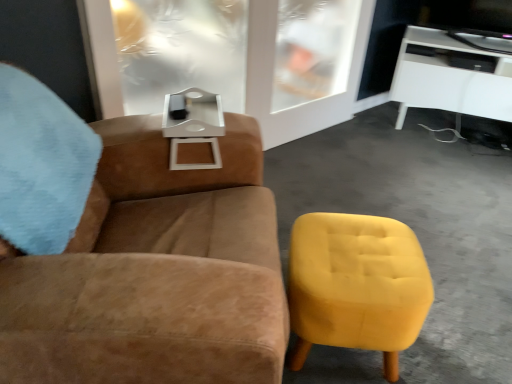
Question: Does white glossy tv stand at upper right contain suede brown armchair at upper left?

Choices:
 (A) no
 (B) yes

Answer: (A)

Question: From the image's perspective, is white glossy tv stand at upper right over suede brown armchair at upper left?

Choices:
 (A) no
 (B) yes

Answer: (B)

Question: Is white glossy tv stand at upper right located outside suede brown armchair at upper left?

Choices:
 (A) no
 (B) yes

Answer: (B)

Question: From a real-world perspective, does white glossy tv stand at upper right stand above suede brown armchair at upper left?

Choices:
 (A) no
 (B) yes

Answer: (A)

Question: Considering the relative sizes of white glossy tv stand at upper right and suede brown armchair at upper left in the image provided, is white glossy tv stand at upper right taller than suede brown armchair at upper left?

Choices:
 (A) yes
 (B) no

Answer: (B)

Question: Is yellow fabric ottoman at lower right in front of or behind suede brown armchair at upper left in the image?

Choices:
 (A) front
 (B) behind

Answer: (B)

Question: Considering the relative positions of yellow fabric ottoman at lower right and suede brown armchair at upper left in the image provided, is yellow fabric ottoman at lower right to the left or to the right of suede brown armchair at upper left?

Choices:
 (A) right
 (B) left

Answer: (A)

Question: From the image's perspective, relative to suede brown armchair at upper left, is yellow fabric ottoman at lower right above or below?

Choices:
 (A) above
 (B) below

Answer: (B)

Question: Looking at their shapes, would you say yellow fabric ottoman at lower right is wider or thinner than suede brown armchair at upper left?

Choices:
 (A) wide
 (B) thin

Answer: (B)

Question: From their relative heights in the image, would you say suede brown armchair at upper left is taller or shorter than yellow fabric ottoman at lower right?

Choices:
 (A) tall
 (B) short

Answer: (A)

Question: Is point (152, 359) positioned closer to the camera than point (360, 294)?

Choices:
 (A) farther
 (B) closer

Answer: (B)

Question: Choose the correct answer: Is suede brown armchair at upper left inside yellow fabric ottoman at lower right or outside it?

Choices:
 (A) outside
 (B) inside

Answer: (A)

Question: From the image's perspective, relative to yellow fabric ottoman at lower right, is suede brown armchair at upper left above or below?

Choices:
 (A) below
 (B) above

Answer: (B)

Question: Considering their positions, is white glossy tv stand at upper right located in front of or behind transparent glass door at upper center?

Choices:
 (A) behind
 (B) front

Answer: (A)

Question: From their relative heights in the image, would you say white glossy tv stand at upper right is taller or shorter than transparent glass door at upper center?

Choices:
 (A) short
 (B) tall

Answer: (A)